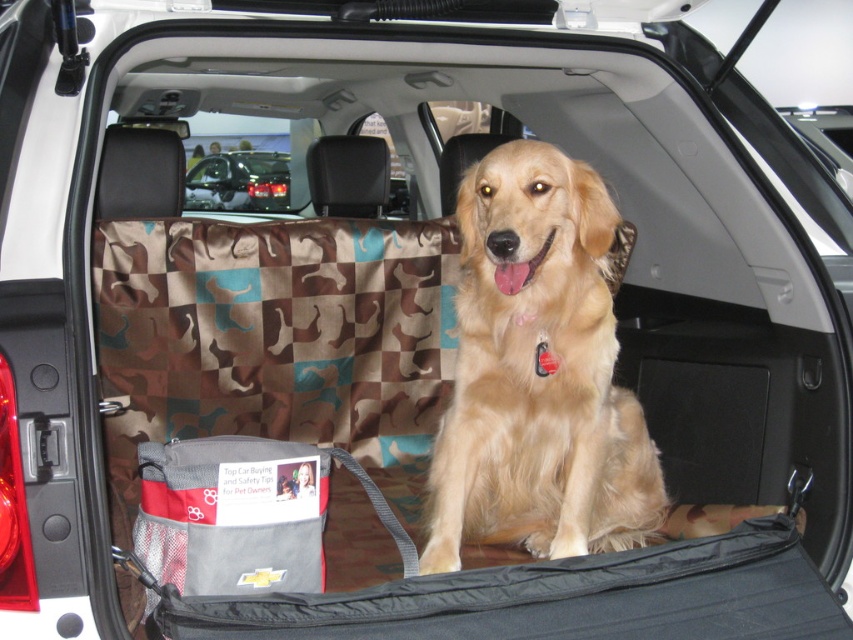
You are a delivery person who needs to load a package into the vehicle. The package is too large to fit through the back door. You see the golden fur dog at center and the shiny black car at center. Which object is lower and can the package be placed there?

The golden fur dog at center is located below the shiny black car at center. Since the dog is lower, you can place the package where the golden fur dog at center is located, but ensure the dog is moved first to avoid discomfort.

You are planning to transport two items in the vehicle shown. The golden fur dog at center and the shiny black car at center are both in the cargo area. Since the cargo space is limited, which item should you prioritize removing to free up more space?

The golden fur dog at center is bigger than the shiny black car at center, so you should prioritize removing the golden fur dog at center to free up more space.

In the scene shown: You are a delivery person who needs to load a box that is 5 feet long into the cargo area of the SUV. The box must be placed in such a way that it doesn not block the golden fur dog at center. Is there enough space to do this?

The golden fur dog at center is 6.45 feet away from the camera. Since the box is 5 feet long, there is sufficient space to place the box without blocking the dog as long as it is positioned appropriately.